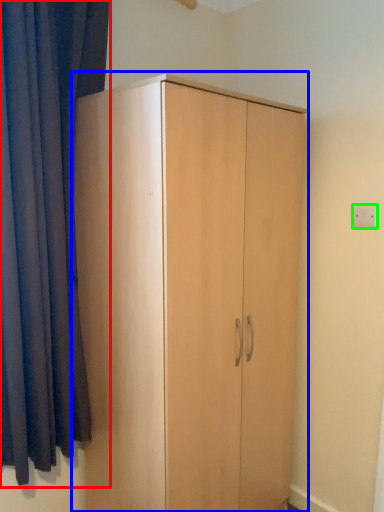
Question: Which is nearer to the curtain (highlighted by a red box)? cupboard (highlighted by a blue box) or electric outlet (highlighted by a green box).

Choices:
 (A) cupboard
 (B) electric outlet

Answer: (A)